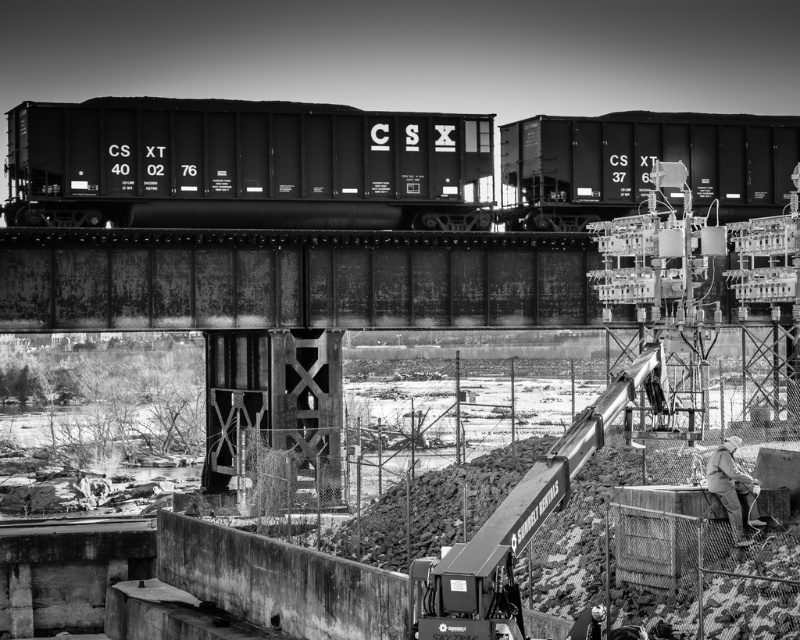
You are a photographer standing at the base of the railway bridge and want to capture both point [696,186] and point [590,124] in your photo. Which point will appear closer to the bottom edge of the photo?

Point [590,124] will appear closer to the bottom edge of the photo because it is further away from the viewer compared to point [696,186], which is closer to the photographer.

You are a photographer standing at the base of the railway bridge. You want to take a photo of the matte black train car at upper right and the khaki fabric jacket at lower right in the same frame. Given that your camera has a maximum zoom range of 50 feet, will you be able to capture both objects in a single shot without moving your position?

The distance between the matte black train car at upper right and the khaki fabric jacket at lower right is 67.31 feet. Since your camera can only zoom up to 50 feet, you won not be able to capture both objects in a single shot without moving your position.